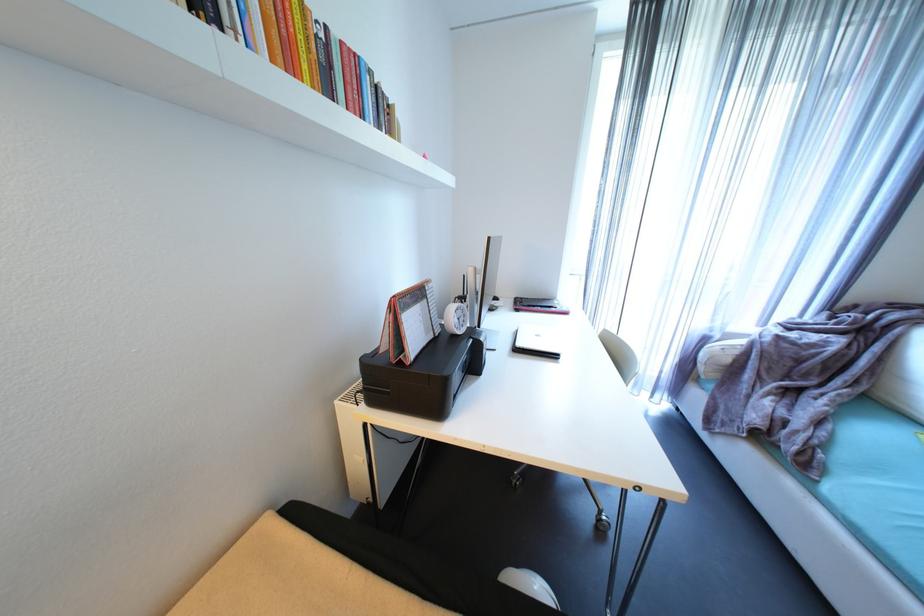
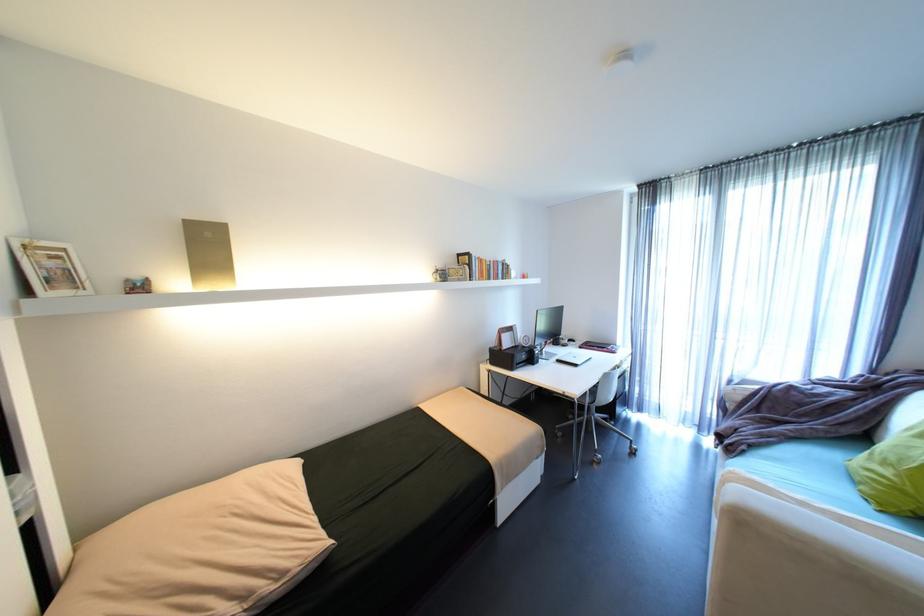
Where in the second image is the point corresponding to pixel 558 307 from the first image?

(612, 347)